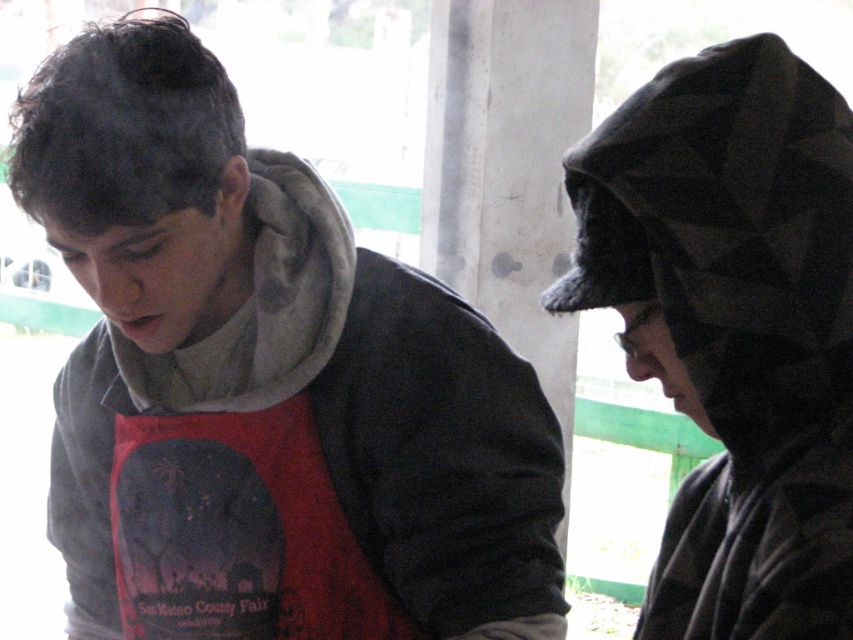
Question: Is matte gray hoodie at center smaller than camouflage fabric hood at right?

Choices:
 (A) yes
 (B) no

Answer: (B)

Question: Which point appears farthest from the camera in this image?

Choices:
 (A) (138, 106)
 (B) (809, 134)

Answer: (A)

Question: Is matte gray hoodie at center bigger than camouflage fabric hood at right?

Choices:
 (A) yes
 (B) no

Answer: (A)

Question: Does matte gray hoodie at center have a smaller size compared to camouflage fabric hood at right?

Choices:
 (A) no
 (B) yes

Answer: (A)